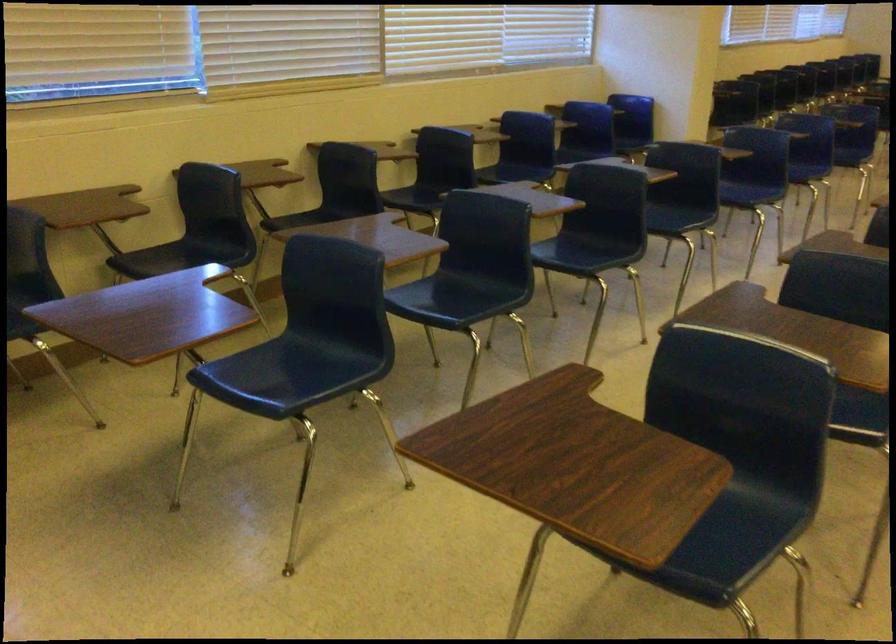
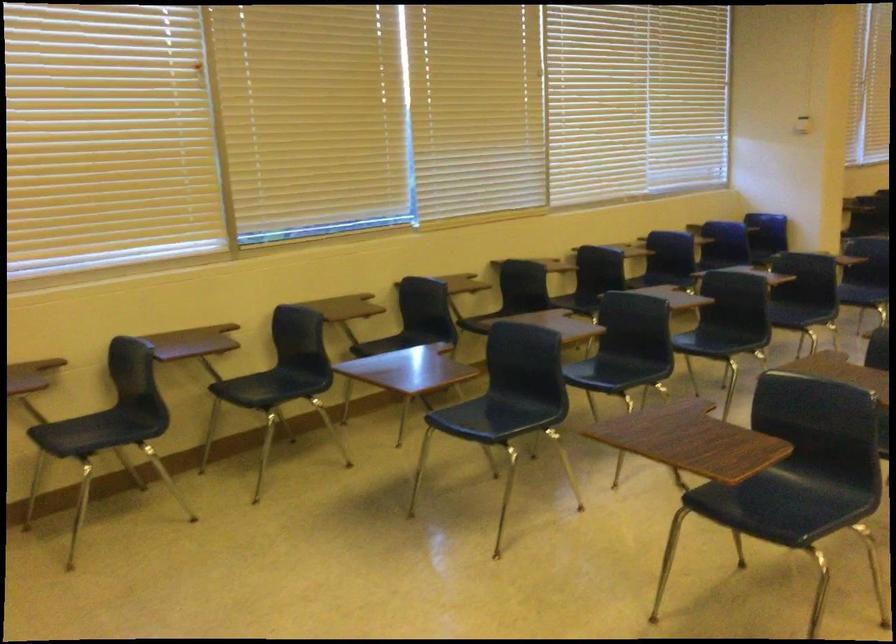
Question: In a continuous first-person perspective shot, in which direction is the camera moving?

Choices:
 (A) Left
 (B) Right
 (C) Forward
 (D) Backward

Answer: (D)